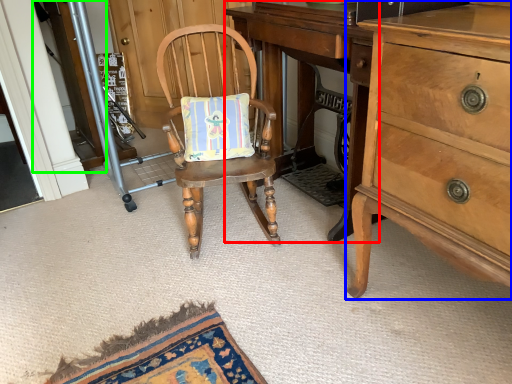
Question: Which is farther away from changing table (highlighted by a red box)? cabinetry (highlighted by a blue box) or screen door (highlighted by a green box)?

Choices:
 (A) cabinetry
 (B) screen door

Answer: (B)